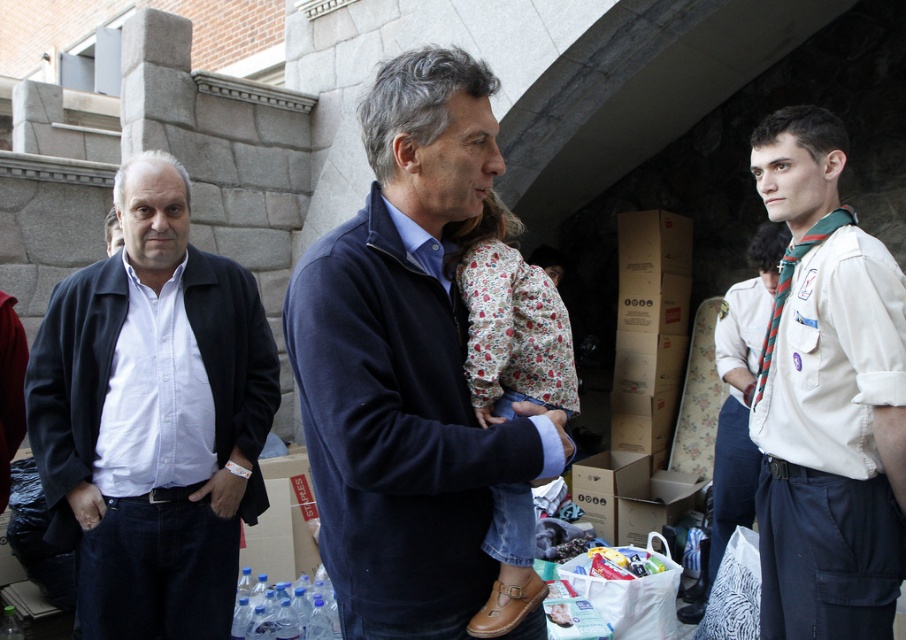
Who is positioned more to the left, white cotton shirt at right or white cotton shirt at center?

Positioned to the left is white cotton shirt at right.

Can you confirm if white cotton shirt at right is positioned to the right of white cotton shirt at center?

No, white cotton shirt at right is not to the right of white cotton shirt at center.

Measure the distance between white cotton shirt at right and camera.

white cotton shirt at right and camera are 10.64 feet apart.

The height and width of the screenshot is (640, 906). Find the location of `white cotton shirt at right`. white cotton shirt at right is located at coordinates (827, 397).

Between dark blue sweater at center and white cotton shirt at center, which one has less height?

dark blue sweater at center

Does point (450, 225) lie behind point (755, 374)?

No, (450, 225) is in front of (755, 374).

Image resolution: width=906 pixels, height=640 pixels. I want to click on dark blue sweater at center, so click(x=407, y=365).

Is dark blue sweater at center below white cotton shirt at right?

No.

Can you confirm if dark blue sweater at center is positioned above white cotton shirt at right?

Yes, dark blue sweater at center is above white cotton shirt at right.

What do you see at coordinates (407, 365) in the screenshot?
I see `dark blue sweater at center` at bounding box center [407, 365].

Image resolution: width=906 pixels, height=640 pixels. I want to click on dark blue sweater at center, so click(407, 365).